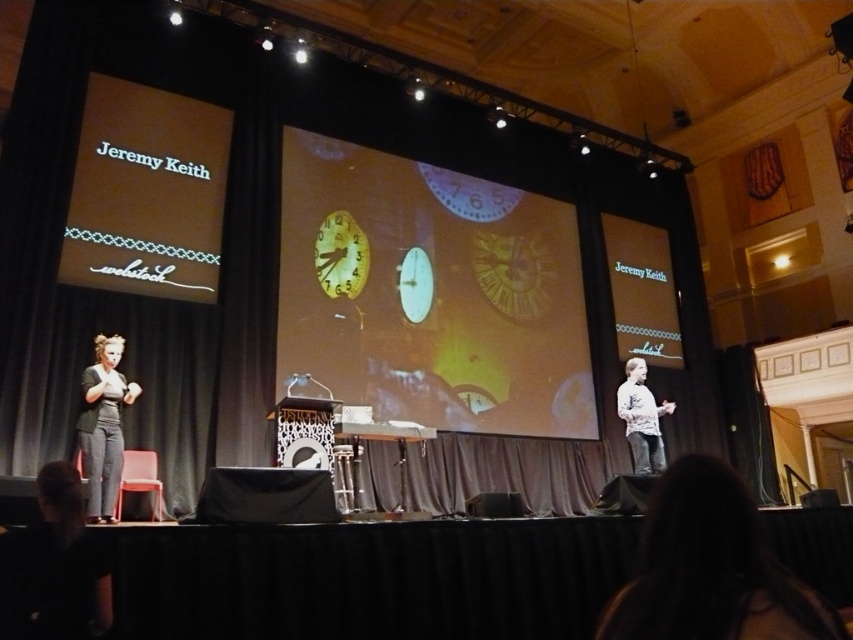
Question: Observing the image, what is the correct spatial positioning of translucent glass clock at center in reference to white textured shirt at center?

Choices:
 (A) right
 (B) left

Answer: (B)

Question: Does translucent glass clock at center appear under dark gray textured pants at left?

Choices:
 (A) yes
 (B) no

Answer: (B)

Question: Which point is closer to the camera?

Choices:
 (A) (x=651, y=520)
 (B) (x=96, y=512)
 (C) (x=637, y=385)

Answer: (A)

Question: Is translucent glass clock at center positioned at the back of dark gray textured pants at left?

Choices:
 (A) yes
 (B) no

Answer: (A)

Question: Among these objects, which one is nearest to the camera?

Choices:
 (A) dark hair at lower right
 (B) translucent glass clock at center

Answer: (A)

Question: Estimate the real-world distances between objects in this image. Which object is closer to the translucent glass clock at center?

Choices:
 (A) dark hair at lower right
 (B) dark gray textured pants at left

Answer: (B)